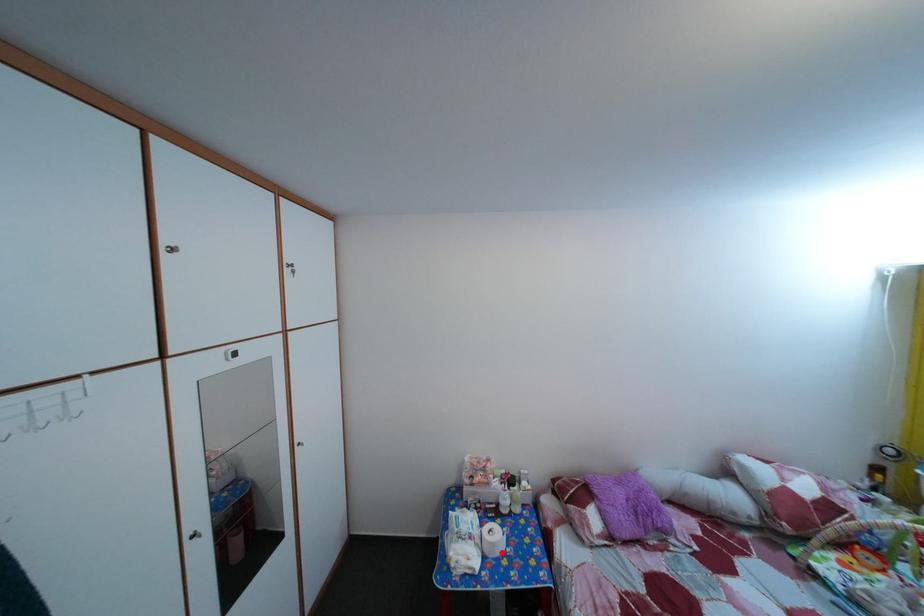
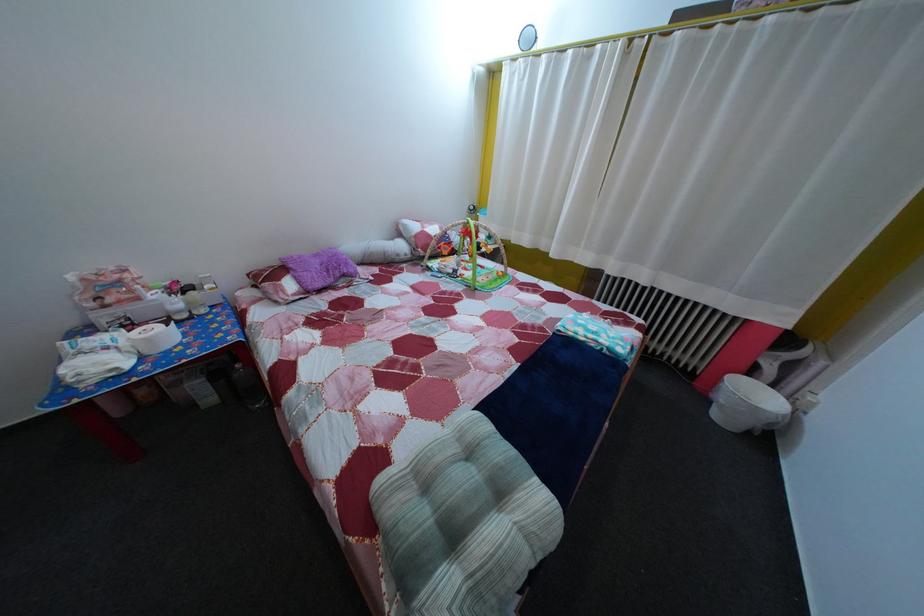
Where in the second image is the point corresponding to the highlighted location from the first image?

(157, 347)